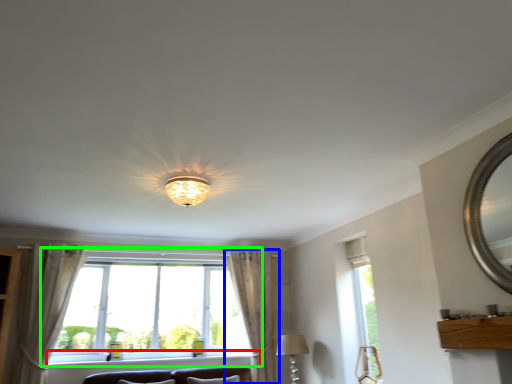
Question: Estimate the real-world distances between objects in this image. Which object is closer to window sill (highlighted by a red box), curtain (highlighted by a blue box) or window (highlighted by a green box)?

Choices:
 (A) curtain
 (B) window

Answer: (B)